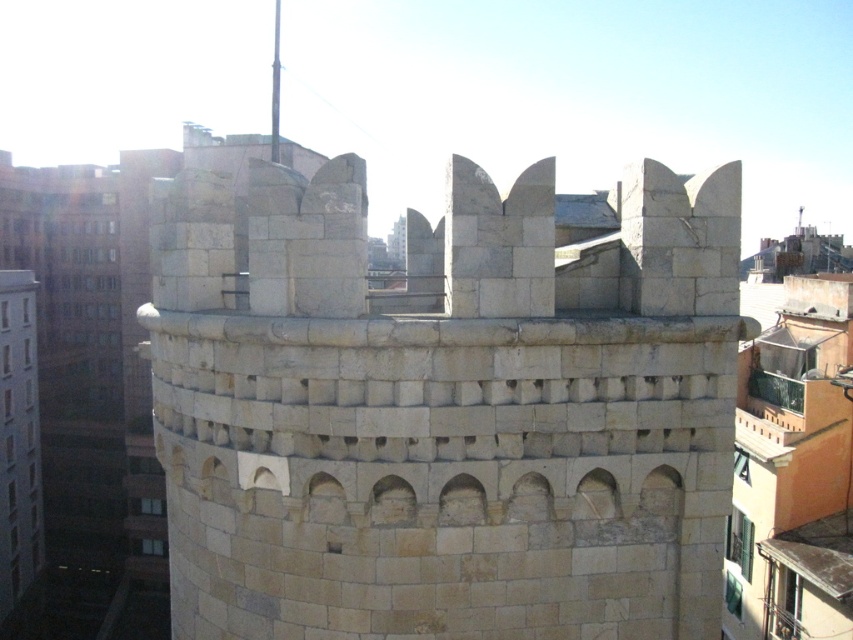
You are standing in front of the stone structure and want to determine the relative positions of two specific points marked on the structure. Which point is closer to you, point 1 at coordinates point (283, 525) or point 2 at coordinates point (0, 522)?

Point 1 at coordinates point (283, 525) is closer to the viewer than point 2 at coordinates point (0, 522).

You are an architect examining the stone structures in the image. You need to determine the spatial relationship between the white stone tower at center and the beige stone tower at left. Which tower is located in front of the other?

The white stone tower at center is positioned over beige stone tower at left, meaning it is in front of the beige stone tower at left.